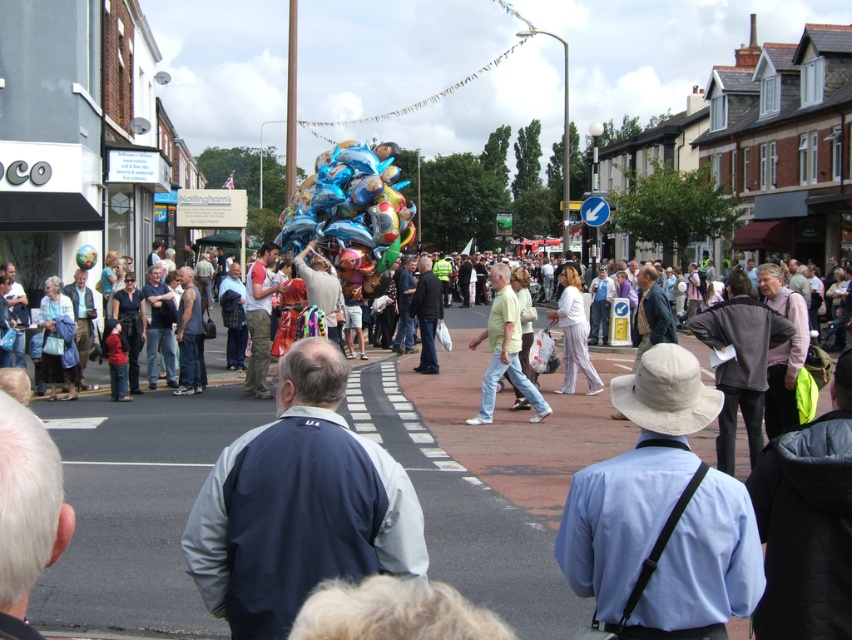
Does light beige hat at center appear over white silk pants at center?

Incorrect, light beige hat at center is not positioned above white silk pants at center.

Does light beige hat at center have a larger size compared to white silk pants at center?

No.

Does point (746, 353) come behind point (586, 388)?

No, it is in front of (586, 388).

I want to click on light beige hat at center, so click(x=740, y=362).

Does point (303, 545) come behind point (254, 273)?

That is False.

Is dark blue jacket at center positioned at the back of camouflage pants at center?

That is False.

Who is more distant from viewer, (343, 538) or (252, 316)?

Point (252, 316)

The width and height of the screenshot is (852, 640). I want to click on dark blue jacket at center, so click(x=298, y=506).

Does point (743, 273) come closer to viewer compared to point (258, 378)?

Yes, it is in front of point (258, 378).

Who is taller, light beige hat at center or camouflage pants at center?

camouflage pants at center is taller.

You are a GUI agent. You are given a task and a screenshot of the screen. Output one action in this format:
    pyautogui.click(x=<x>, y=<y>)
    Task: Click on the light beige hat at center
    The height and width of the screenshot is (640, 852).
    Given the screenshot: What is the action you would take?
    pyautogui.click(x=740, y=362)

Where is `light beige hat at center`? The height and width of the screenshot is (640, 852). light beige hat at center is located at coordinates (740, 362).